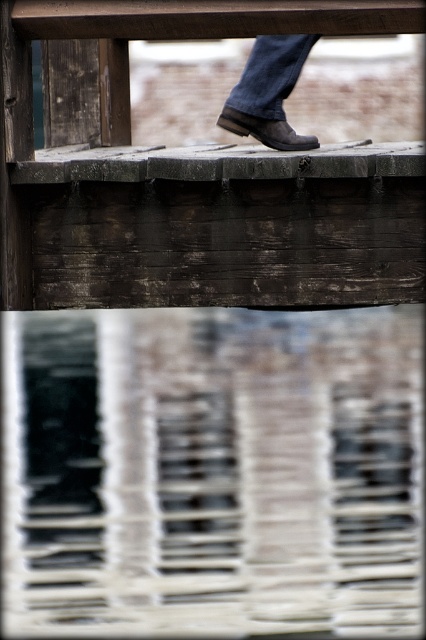
You are standing on a wooden dock and see the translucent glass water at center and the brown leather boot at center. Which object is higher in elevation?

The translucent glass water at center is taller than the brown leather boot at center, so the water is higher in elevation.

You are designing a shoe rack and want to place the denim at center and the brown leather boot at center side by side. Which object should you allocate more space for in terms of thickness?

The brown leather boot at center is thicker than the denim at center, so you should allocate more space for the brown leather boot at center in terms of thickness.

You are standing on the wooden structure in the top section of the image. There is a point marked at coordinates (213, 472). What is located at that point?

The point at (213, 472) is on translucent glass water at center.